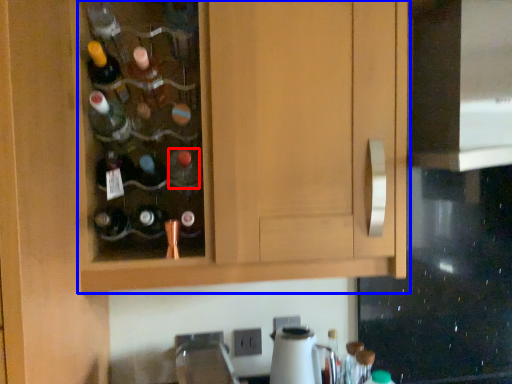
Question: Which point is closer to the camera, bottle (highlighted by a red box) or cabinetry (highlighted by a blue box)?

Choices:
 (A) bottle
 (B) cabinetry

Answer: (B)